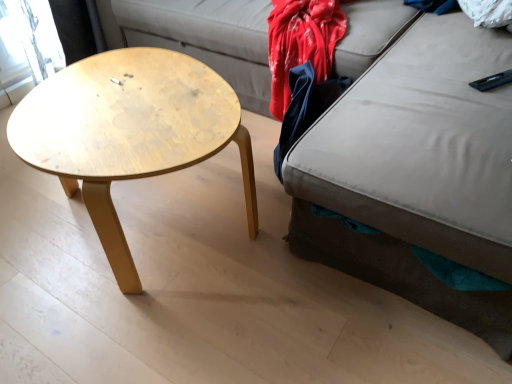
Measure the distance between point (194, 117) and camera.

Point (194, 117) is 1.21 meters from camera.

What is the approximate height of natural wood coffee table at left?

18.22 inches.

Identify the location of natural wood coffee table at left. 129,132.

Describe the element at coordinates (129, 132) in the screenshot. I see `natural wood coffee table at left` at that location.

What is the approximate height of dark blue fabric at right?

dark blue fabric at right is 17.83 inches tall.

Describe the element at coordinates (305, 107) in the screenshot. Image resolution: width=512 pixels, height=384 pixels. I see `dark blue fabric at right` at that location.

This screenshot has width=512, height=384. In order to click on dark blue fabric at right in this screenshot , I will do `click(305, 107)`.

Identify the location of natural wood coffee table at left. (129, 132).

Does dark blue fabric at right appear on the right side of natural wood coffee table at left?

Indeed, dark blue fabric at right is positioned on the right side of natural wood coffee table at left.

Is dark blue fabric at right in front of or behind natural wood coffee table at left in the image?

Clearly, dark blue fabric at right is behind natural wood coffee table at left.

Which is closer, (307, 124) or (112, 70)?

Point (112, 70)

From the image's perspective, which object appears higher, dark blue fabric at right or natural wood coffee table at left?

dark blue fabric at right is shown above in the image.

From a real-world perspective, is dark blue fabric at right over natural wood coffee table at left?

No, from a real-world perspective, dark blue fabric at right is not above natural wood coffee table at left.

Which object is wider, dark blue fabric at right or natural wood coffee table at left?

Answer: natural wood coffee table at left.

Between dark blue fabric at right and natural wood coffee table at left, which one has more height?

natural wood coffee table at left is taller.

Which of these two, dark blue fabric at right or natural wood coffee table at left, is smaller?

With smaller size is dark blue fabric at right.

Based on the photo, is dark blue fabric at right spatially inside natural wood coffee table at left, or outside of it?

dark blue fabric at right cannot be found inside natural wood coffee table at left.

Is dark blue fabric at right directly adjacent to natural wood coffee table at left?

No, dark blue fabric at right is not in contact with natural wood coffee table at left.

Is natural wood coffee table at left at the back of dark blue fabric at right?

No, dark blue fabric at right is not facing away from natural wood coffee table at left.

What's the angular difference between dark blue fabric at right and natural wood coffee table at left's facing directions?

66.8 degrees separate the facing orientations of dark blue fabric at right and natural wood coffee table at left.

At what (x,y) coordinates should I click in order to perform the action: click on clothing located underneath the natural wood coffee table at left (from a real-world perspective). Please return your answer as a coordinate pair (x, y). Looking at the image, I should click on (305, 107).

Is natural wood coffee table at left at the left side of dark blue fabric at right?

Yes.

In the image, is natural wood coffee table at left positioned in front of or behind dark blue fabric at right?

natural wood coffee table at left is in front of dark blue fabric at right.

Is point (70, 87) less distant than point (315, 118)?

Yes, it is.

From the image's perspective, would you say natural wood coffee table at left is positioned over dark blue fabric at right?

No.

From a real-world perspective, between natural wood coffee table at left and dark blue fabric at right, who is vertically lower?

In real-world perspective, dark blue fabric at right is lower.

From the picture: Considering the sizes of objects natural wood coffee table at left and dark blue fabric at right in the image provided, who is wider, natural wood coffee table at left or dark blue fabric at right?

natural wood coffee table at left.

Is natural wood coffee table at left taller than dark blue fabric at right?

Yes, natural wood coffee table at left is taller than dark blue fabric at right.

Looking at the image, does natural wood coffee table at left seem bigger or smaller compared to dark blue fabric at right?

natural wood coffee table at left is bigger than dark blue fabric at right.

Is dark blue fabric at right located within natural wood coffee table at left?

No, dark blue fabric at right is not surrounded by natural wood coffee table at left.

Is natural wood coffee table at left next to dark blue fabric at right and touching it?

natural wood coffee table at left is not next to dark blue fabric at right, and they're not touching.

Is natural wood coffee table at left looking in the opposite direction of dark blue fabric at right?

Absolutely, natural wood coffee table at left is directed away from dark blue fabric at right.

You are a GUI agent. You are given a task and a screenshot of the screen. Output one action in this format:
    pyautogui.click(x=<x>, y=<y>)
    Task: Click on the coffee table on the left of dark blue fabric at right
    The image size is (512, 384).
    Given the screenshot: What is the action you would take?
    pyautogui.click(x=129, y=132)

Locate an element on the screen. clothing on the right of natural wood coffee table at left is located at coordinates (305, 107).

Where is `coffee table above the dark blue fabric at right (from a real-world perspective)`? coffee table above the dark blue fabric at right (from a real-world perspective) is located at coordinates (129, 132).